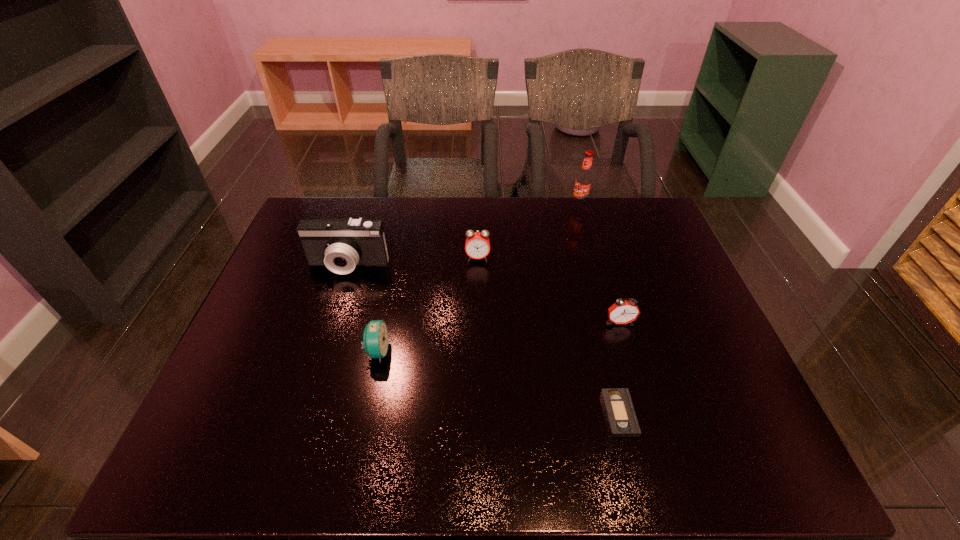
Identify the location of the nearest object. (622, 421).

Identify the location of vacant space situated 0.110m on the front of the tallest object. (587, 230).

I want to click on vacant space located 0.330m on the lens of the camcorder, so click(313, 376).

Locate an element on the screen. free space located on the front-facing side of the third object from left to right is located at coordinates (477, 350).

Where is `free location located 0.090m on the front-facing side of the nearest alarm clock`? free location located 0.090m on the front-facing side of the nearest alarm clock is located at coordinates (425, 351).

Locate an element on the screen. The width and height of the screenshot is (960, 540). free region located on the clock face of the second farthest alarm clock is located at coordinates (657, 447).

Find the location of a particular element. The image size is (960, 540). free spot located 0.330m on the left of the shortest object is located at coordinates (455, 414).

Find the location of a particular element. Image resolution: width=960 pixels, height=540 pixels. object situated at the far edge is located at coordinates (584, 180).

Identify the location of object that is at the near edge. 622,421.

Find the location of a particular element. object present at the left edge is located at coordinates (339, 244).